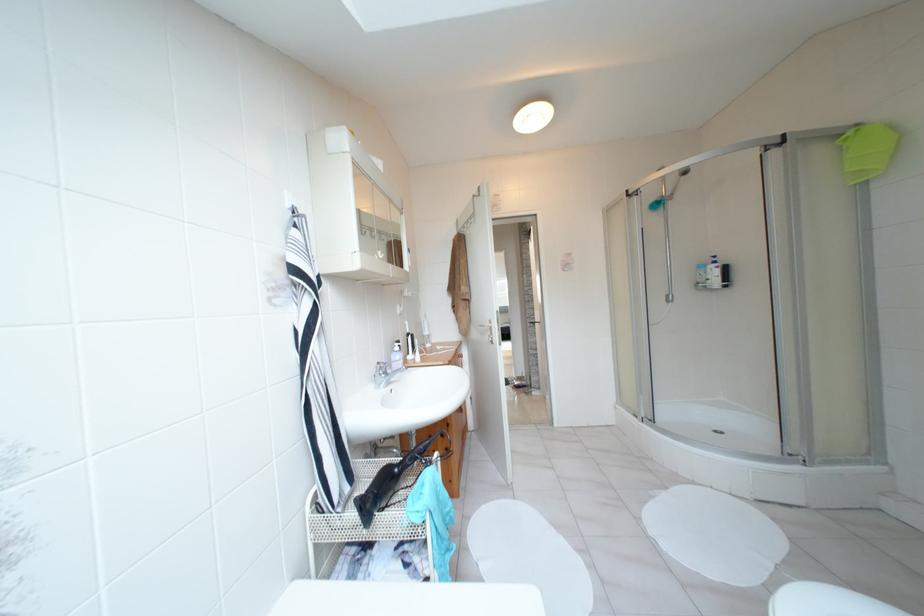
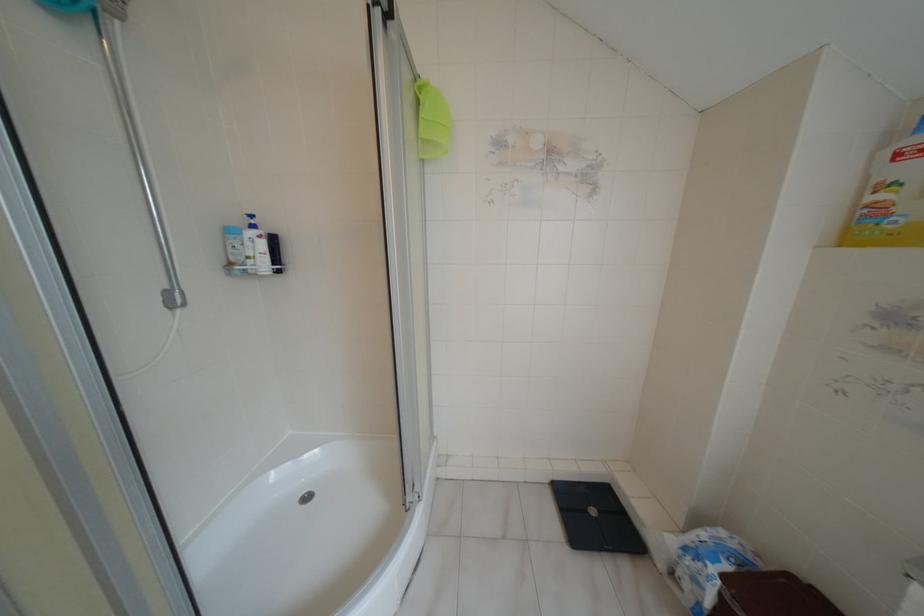
Locate, in the second image, the point that corresponds to (713,257) in the first image.

(251, 216)